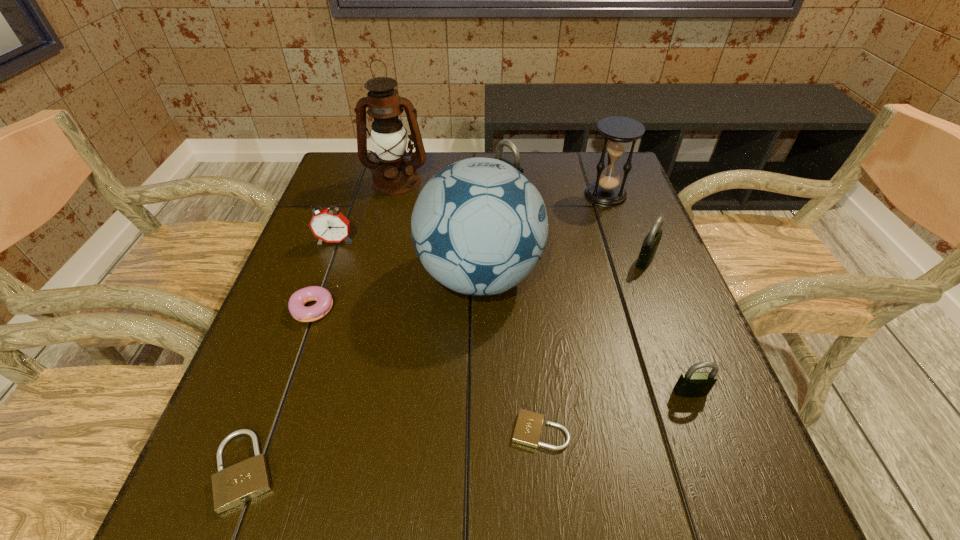
Locate an element on the screen. alarm clock is located at coordinates (329, 225).

The image size is (960, 540). I want to click on the fourth shortest object, so click(x=692, y=384).

At what (x,y) coordinates should I click in order to perform the action: click on the smallest black padlock. Please return your answer as a coordinate pair (x, y). Looking at the image, I should click on point(692,384).

You are a GUI agent. You are given a task and a screenshot of the screen. Output one action in this format:
    pyautogui.click(x=<x>, y=<y>)
    Task: Click on the purple doughnut
    The width and height of the screenshot is (960, 540).
    Given the screenshot: What is the action you would take?
    pyautogui.click(x=296, y=303)

What are the coordinates of `doughnut` in the screenshot? It's located at (296, 303).

Find the location of `the ninth tallest object`. the ninth tallest object is located at coordinates (239, 483).

I want to click on the bigger beige padlock, so click(x=239, y=483).

Image resolution: width=960 pixels, height=540 pixels. I want to click on the shortest padlock, so click(x=528, y=427).

Identify the location of the right beige padlock. Image resolution: width=960 pixels, height=540 pixels. 528,427.

Find the location of a particular element. This screenshot has width=960, height=540. free space located on the side of the tallest object, there is a wick adjustment knob is located at coordinates (381, 240).